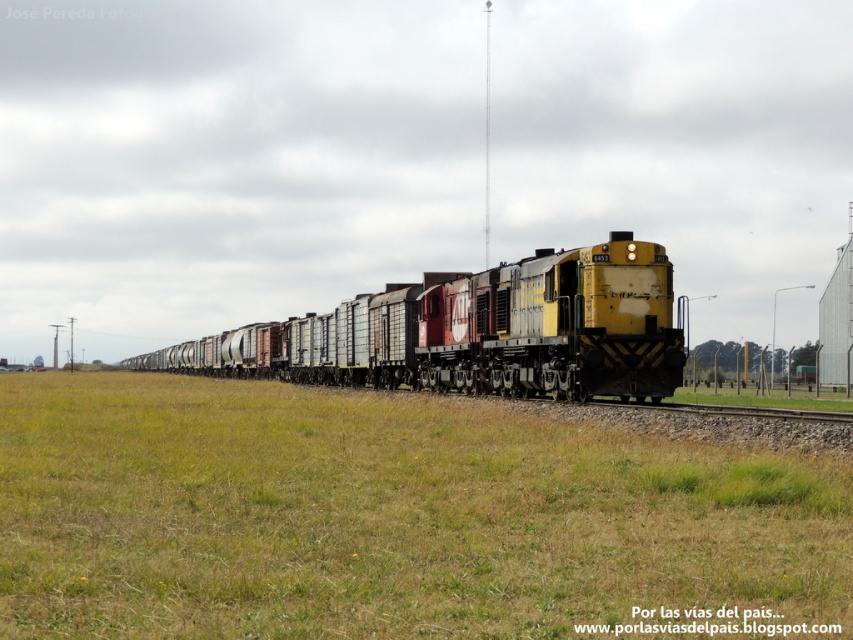
Which is more to the right, green grass at center or yellow matte train at center?

green grass at center is more to the right.

Is green grass at center taller than yellow matte train at center?

Incorrect, green grass at center's height is not larger of yellow matte train at center's.

Describe the element at coordinates (390, 516) in the screenshot. I see `green grass at center` at that location.

This screenshot has width=853, height=640. Find the location of `green grass at center`. green grass at center is located at coordinates (390, 516).